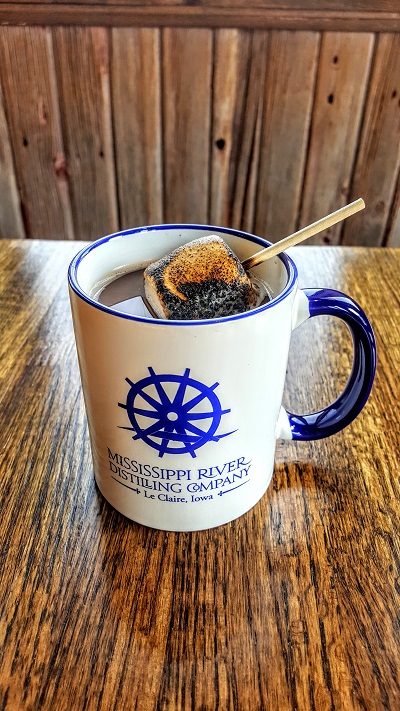
Identify the location of table. Image resolution: width=400 pixels, height=711 pixels. (236, 643).